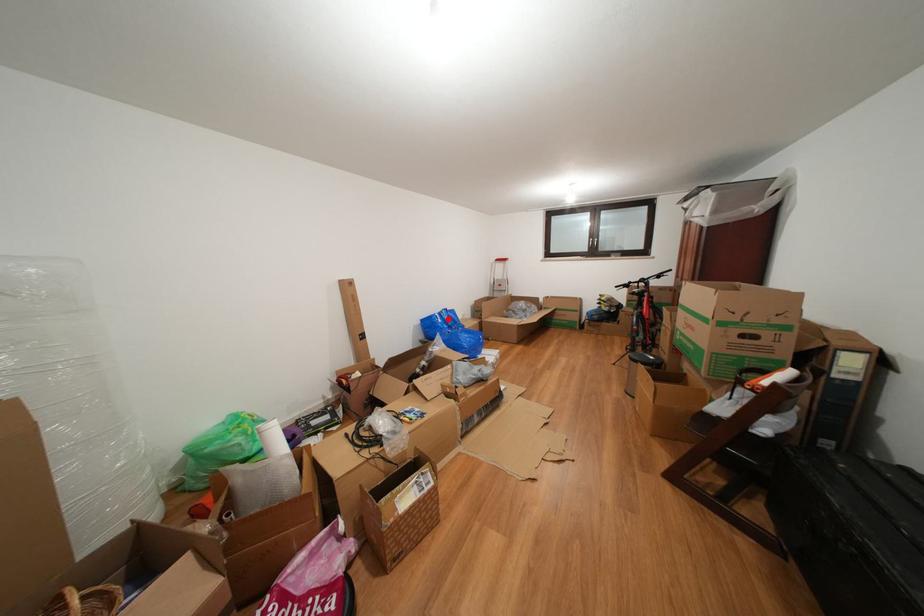
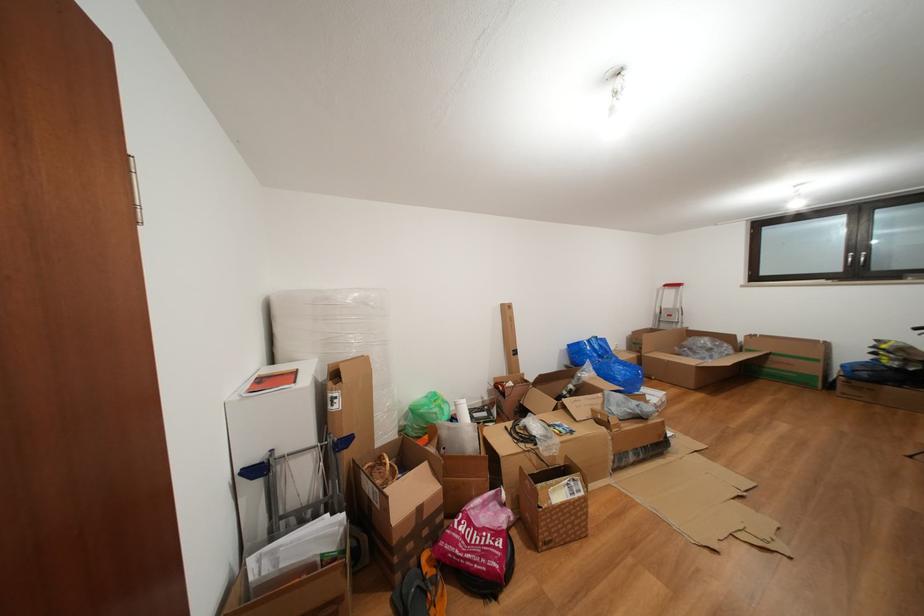
Question: A red point is marked in image1. In image2, is the corresponding 3D point closer to the camera or farther? Reply with the corresponding letter.

Choices:
 (A) The corresponding 3D point is closer.
 (B) The corresponding 3D point is farther.

Answer: (B)